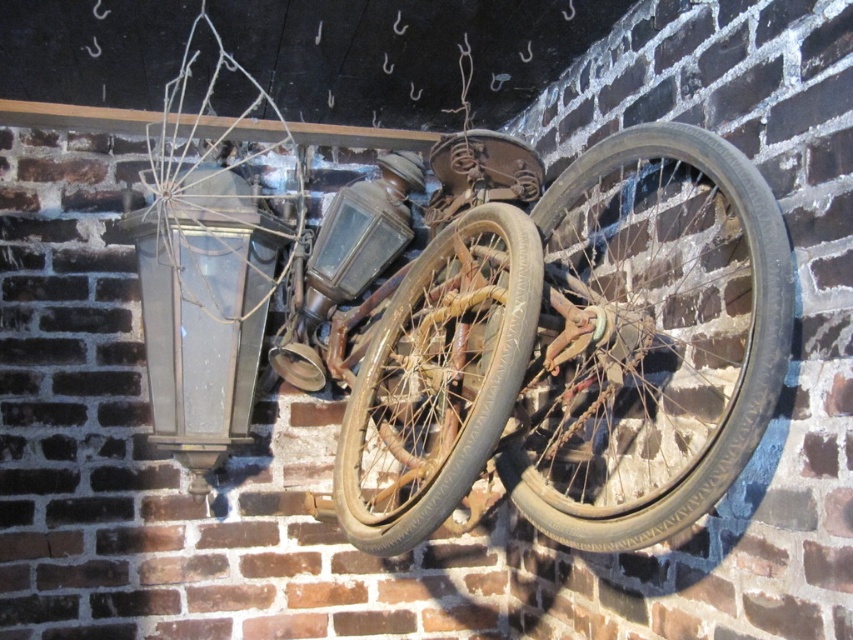
Question: Can you confirm if rusty metal bicycle wheel at center is positioned above rusty metal wheel at center?

Choices:
 (A) no
 (B) yes

Answer: (B)

Question: Is rusty metal bicycle wheel at center above rusty metal wheel at center?

Choices:
 (A) yes
 (B) no

Answer: (A)

Question: Observing the image, what is the correct spatial positioning of rusty metal bicycle wheel at center in reference to rusty metal wheel at center?

Choices:
 (A) above
 (B) below

Answer: (A)